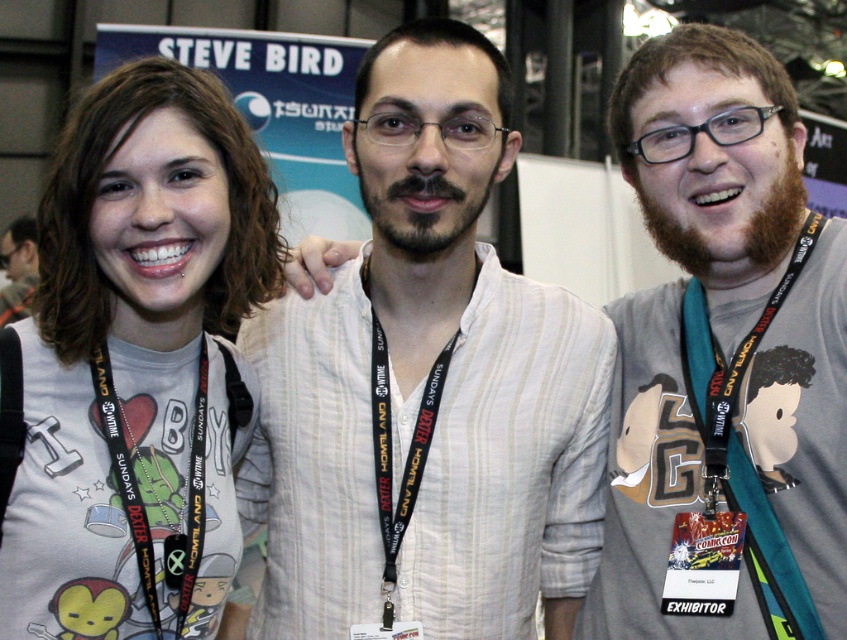
Question: Does white matte t-shirt at center have a greater width compared to beige fabric shirt at center?

Choices:
 (A) yes
 (B) no

Answer: (B)

Question: Is white striped shirt at center wider than black fabric lanyard at center?

Choices:
 (A) no
 (B) yes

Answer: (B)

Question: Which is farther from the beige fabric shirt at center?

Choices:
 (A) black fabric lanyard at center
 (B) white matte t-shirt at center
 (C) matte white shirt at center
 (D) teal fabric lanyard at center

Answer: (C)

Question: Which object is positioned closest to the beige fabric shirt at center?

Choices:
 (A) black fabric lanyard at center
 (B) white striped shirt at center

Answer: (B)

Question: Can you confirm if white striped shirt at center is positioned above beige fabric shirt at center?

Choices:
 (A) yes
 (B) no

Answer: (B)

Question: Which point is farther to the camera?

Choices:
 (A) (112, 77)
 (B) (383, 99)

Answer: (B)